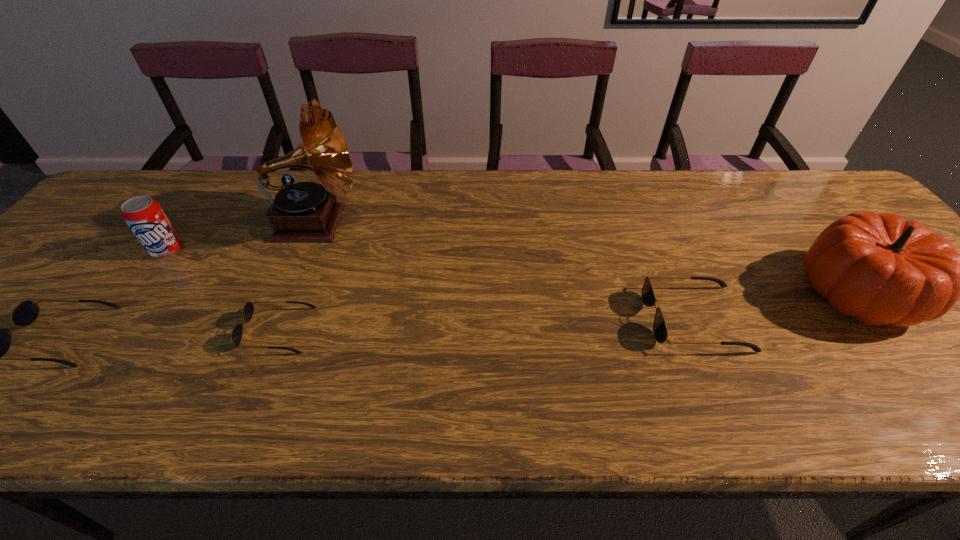
Image resolution: width=960 pixels, height=540 pixels. Find the location of `free location located 0.400m on the front-facing side of the rightmost sunglasses`. free location located 0.400m on the front-facing side of the rightmost sunglasses is located at coordinates (468, 318).

The width and height of the screenshot is (960, 540). I want to click on blank space located on the front-facing side of the rightmost sunglasses, so click(500, 318).

This screenshot has height=540, width=960. I want to click on blank area located on the horn of the tallest object, so click(396, 223).

Find the location of a particular element. The height and width of the screenshot is (540, 960). vacant space located 0.270m on the surface of the fourth shortest object is located at coordinates (94, 349).

This screenshot has height=540, width=960. I want to click on object positioned at the far edge, so click(x=305, y=211).

You are a GUI agent. You are given a task and a screenshot of the screen. Output one action in this format:
    pyautogui.click(x=<x>, y=<y>)
    Task: Click on the vacant space at the far edge of the desktop
    This screenshot has height=540, width=960.
    Given the screenshot: What is the action you would take?
    pyautogui.click(x=463, y=179)

I want to click on vacant region at the near edge of the desktop, so click(x=815, y=356).

You are a GUI agent. You are given a task and a screenshot of the screen. Output one action in this format:
    pyautogui.click(x=<x>, y=<y>)
    Task: Click on the free spot at the left edge of the desktop
    The image size is (960, 540).
    Given the screenshot: What is the action you would take?
    pyautogui.click(x=92, y=284)

The image size is (960, 540). In order to click on vacant space at the right edge of the desktop in this screenshot , I will do `click(919, 342)`.

The width and height of the screenshot is (960, 540). In order to click on empty space between the fifth object from left to right and the second sunglasses from left to right in this screenshot , I will do `click(487, 324)`.